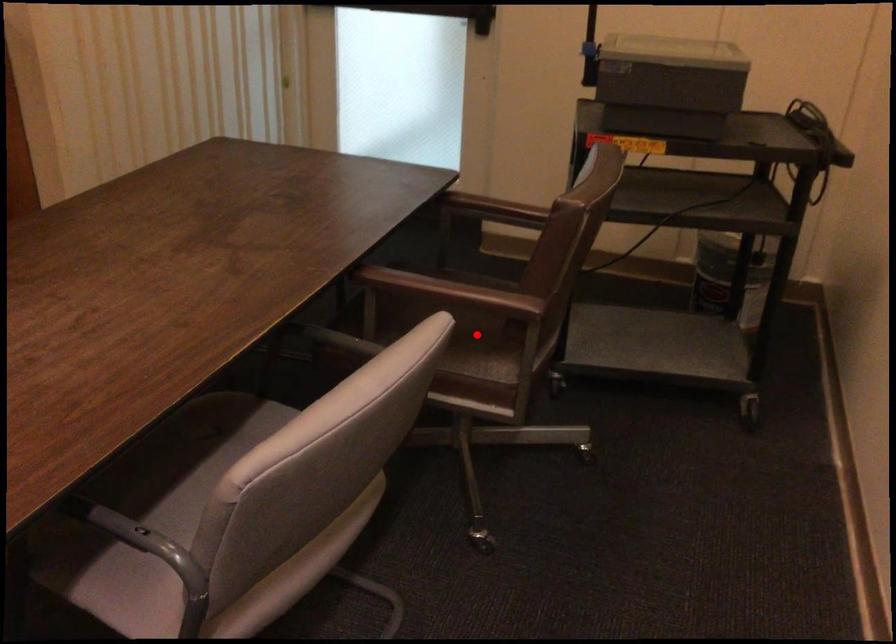
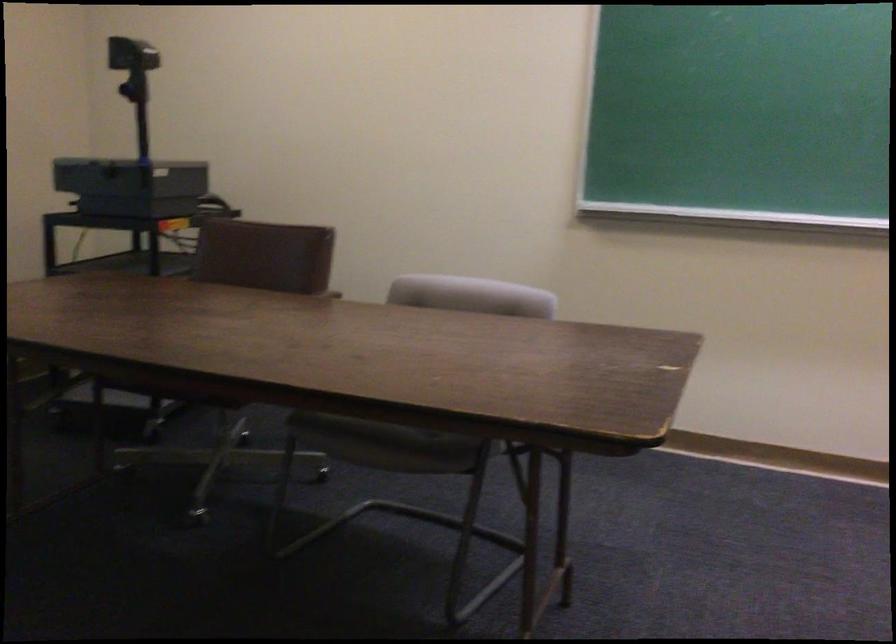
Question: I am providing you with two images of the same scene from different viewpoints. A red point is marked on the first image. Is the red point's position out of view in image 2?

Choices:
 (A) Yes
 (B) No

Answer: (A)